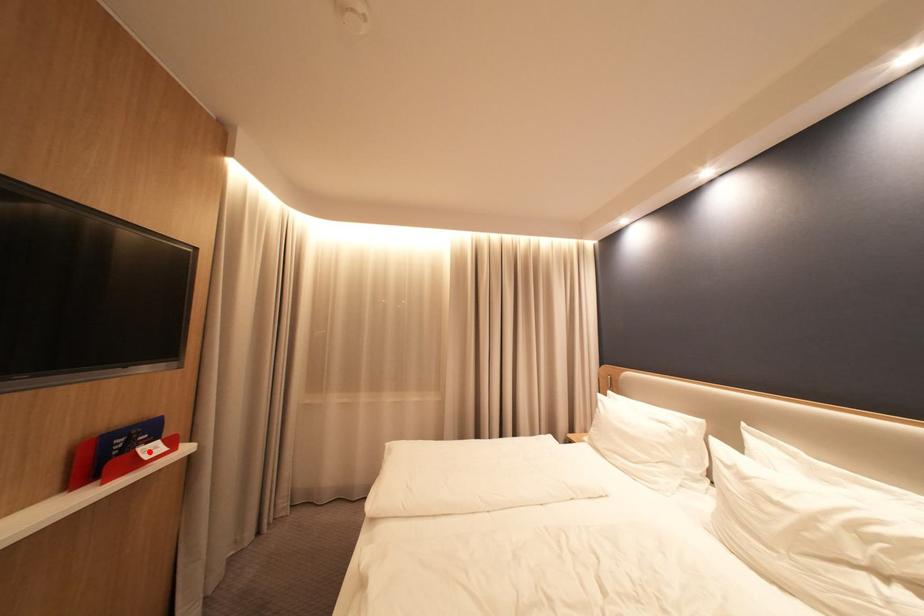
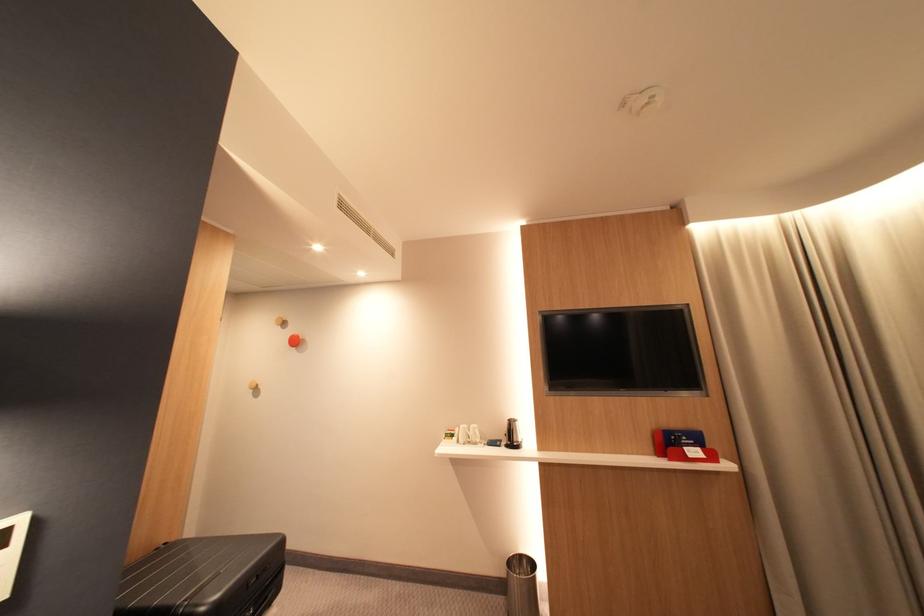
The point at the highlighted location is marked in the first image. Where is the corresponding point in the second image?

(696, 450)